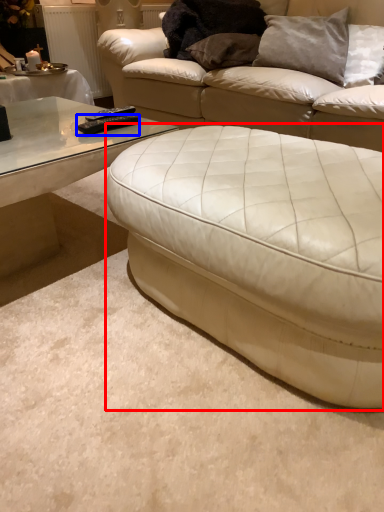
Question: Among these objects, which one is nearest to the camera, studio couch (highlighted by a red box) or remote (highlighted by a blue box)?

Choices:
 (A) studio couch
 (B) remote

Answer: (A)